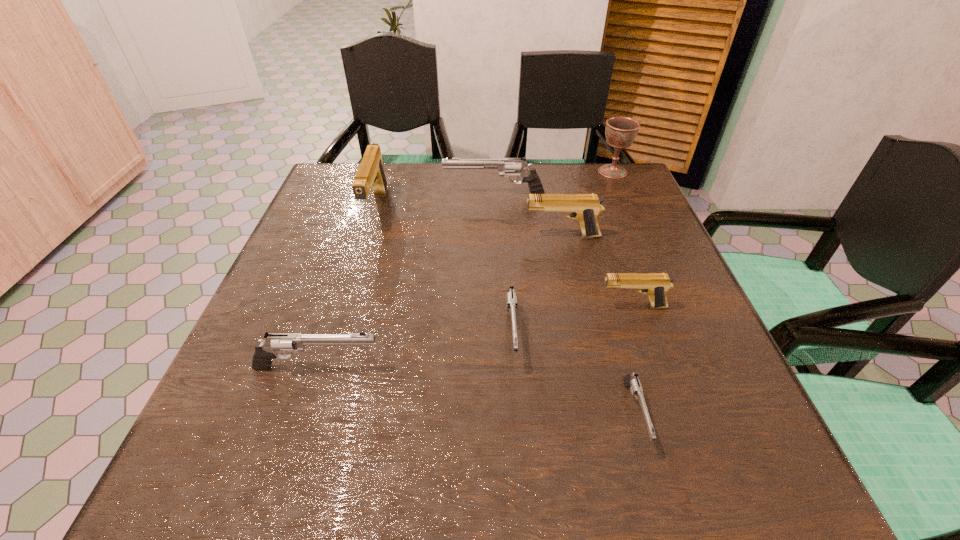
Locate an element on the screen. vacant position located on the front-facing side of the leftmost silver pistol is located at coordinates (558, 367).

At what (x,y) coordinates should I click in order to perform the action: click on vacant space situated 0.400m at the barrel of the smallest tan pistol. Please return your answer as a coordinate pair (x, y). Image resolution: width=960 pixels, height=540 pixels. Looking at the image, I should click on (398, 307).

Where is `vacant position located 0.060m at the barrel of the smallest tan pistol`? The width and height of the screenshot is (960, 540). vacant position located 0.060m at the barrel of the smallest tan pistol is located at coordinates [x=568, y=307].

Image resolution: width=960 pixels, height=540 pixels. In order to click on vacant region located at the barrel of the smallest tan pistol in this screenshot , I will do `click(499, 307)`.

Identify the location of free space located 0.050m on the front-facing side of the seventh tallest object. (516, 397).

Locate an element on the screen. chalice that is at the far edge is located at coordinates (620, 131).

Locate an element on the screen. object present at the near edge is located at coordinates (631, 380).

This screenshot has height=540, width=960. I want to click on chalice located in the right edge section of the desktop, so click(620, 131).

Locate an element on the screen. The image size is (960, 540). object that is at the far left corner is located at coordinates (370, 175).

Locate an element on the screen. The image size is (960, 540). object that is at the far right corner is located at coordinates (620, 131).